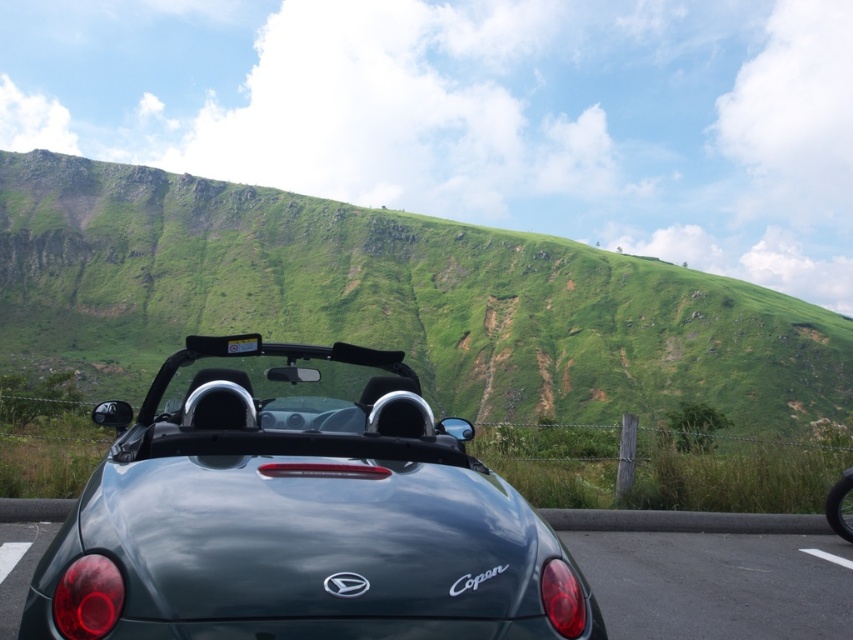
Question: Which point is farther to the camera?

Choices:
 (A) green grassy hillside at center
 (B) shiny black tire at lower right
 (C) glossy dark green car at lower center

Answer: (A)

Question: Which object appears farthest from the camera in this image?

Choices:
 (A) green grassy hillside at center
 (B) satin black convertible at center
 (C) shiny black tire at lower right

Answer: (A)

Question: Is green grassy hillside at center further to camera compared to shiny black tire at lower right?

Choices:
 (A) no
 (B) yes

Answer: (B)

Question: Which object appears closest to the camera in this image?

Choices:
 (A) green grassy hillside at center
 (B) shiny black tire at lower right
 (C) glossy dark green car at lower center

Answer: (C)

Question: Is green grassy hillside at center smaller than satin black convertible at center?

Choices:
 (A) yes
 (B) no

Answer: (B)

Question: Is green grassy hillside at center above satin black convertible at center?

Choices:
 (A) yes
 (B) no

Answer: (A)